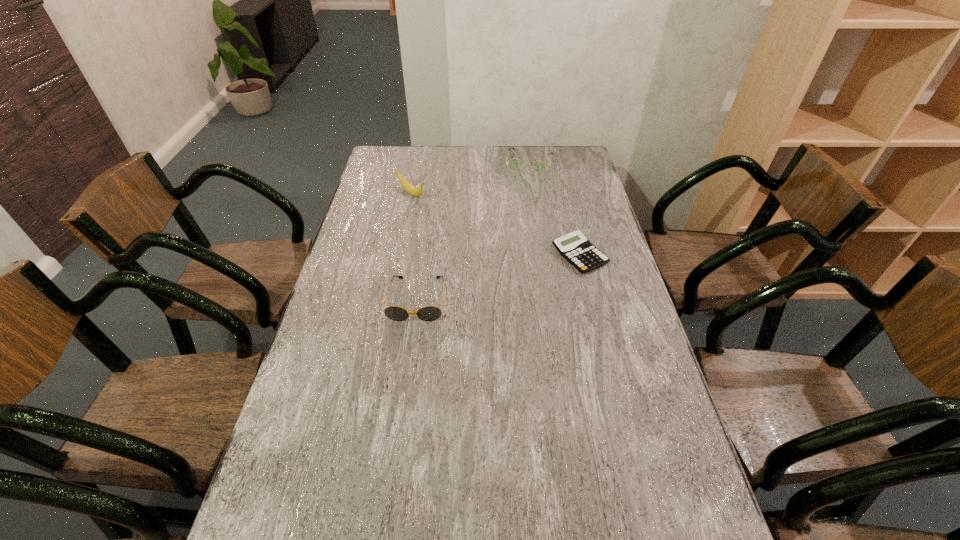
Image resolution: width=960 pixels, height=540 pixels. What are the coordinates of `vacant region located at the stem of the banana` in the screenshot? It's located at (471, 240).

Find the location of a particular element. This screenshot has height=540, width=960. blank area located on the lenses of the spectacles is located at coordinates (519, 195).

The image size is (960, 540). What are the coordinates of `free space located 0.330m on the lenses of the spectacles` in the screenshot? It's located at (511, 222).

Find the location of `free point located 0.110m on the lenses of the spectacles`. free point located 0.110m on the lenses of the spectacles is located at coordinates (521, 190).

Where is `object at the far edge`? object at the far edge is located at coordinates (515, 165).

At what (x,y) coordinates should I click in order to perform the action: click on object that is positioned at the left edge. Please return your answer as a coordinate pair (x, y). Looking at the image, I should click on (411, 189).

Identify the location of calculator that is at the right edge. The height and width of the screenshot is (540, 960). (574, 247).

Locate an element on the screen. spectacles that is positioned at the right edge is located at coordinates (515, 165).

I want to click on object that is at the far right corner, so click(515, 165).

Image resolution: width=960 pixels, height=540 pixels. In order to click on vacant space at the far edge of the desktop in this screenshot , I will do `click(468, 160)`.